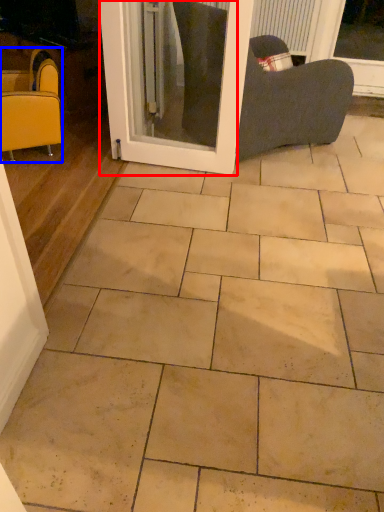
Question: Which point is closer to the camera, screen door (highlighted by a red box) or chair (highlighted by a blue box)?

Choices:
 (A) screen door
 (B) chair

Answer: (A)